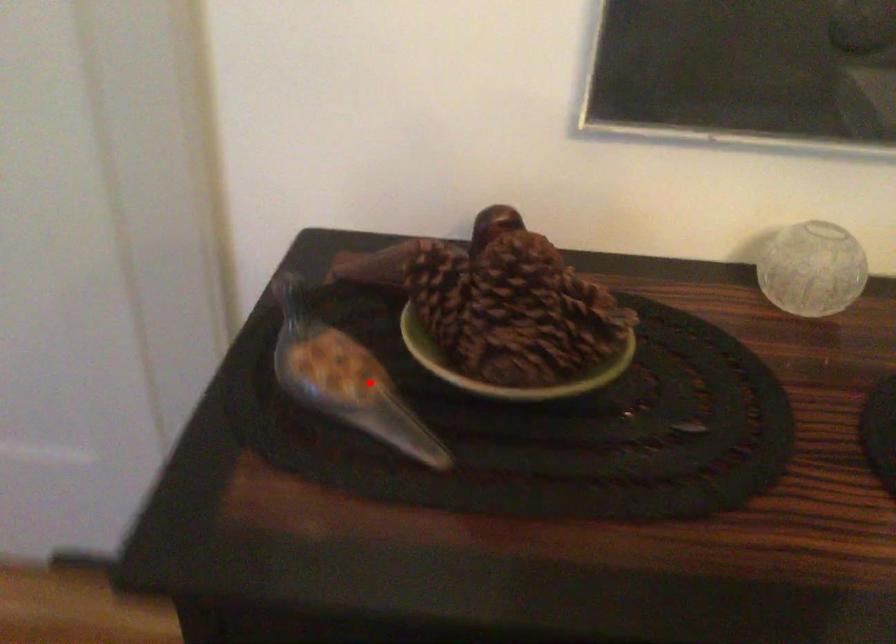
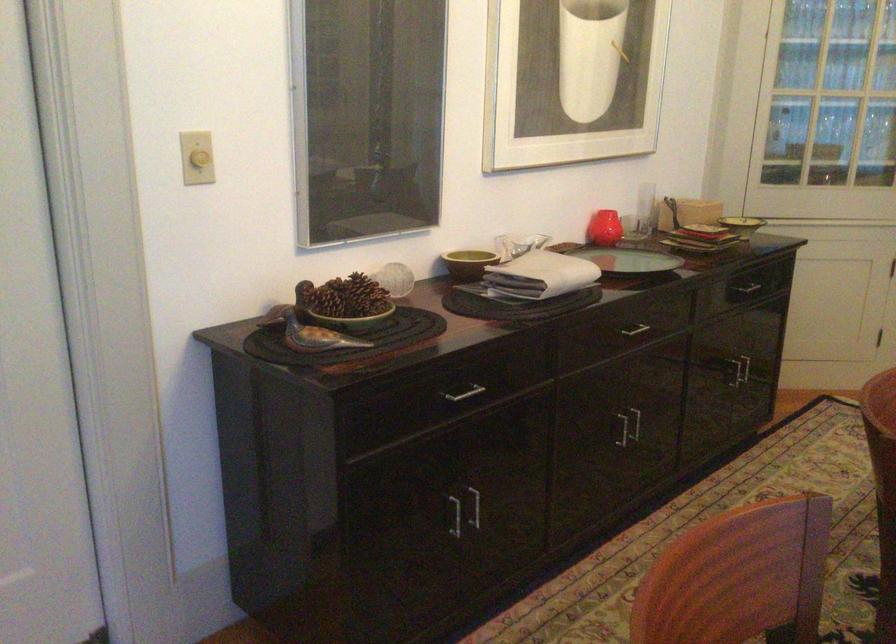
In the second image, find the point that corresponds to the highlighted location in the first image.

(312, 333)